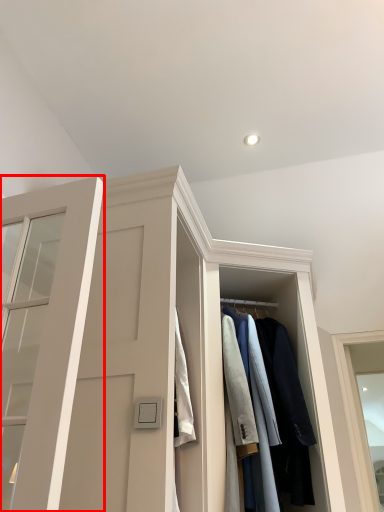
Question: From the image's perspective, where is door (annotated by the red box) located in relation to clothing in the image?

Choices:
 (A) above
 (B) below

Answer: (A)